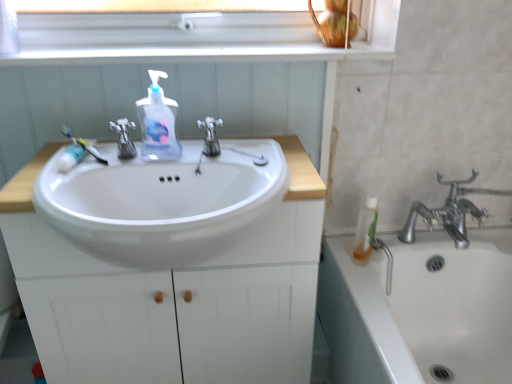
Where is `blank space to the left of satin nickel faucet at center, acting as the first tap starting from the left`? The height and width of the screenshot is (384, 512). blank space to the left of satin nickel faucet at center, acting as the first tap starting from the left is located at coordinates (54, 172).